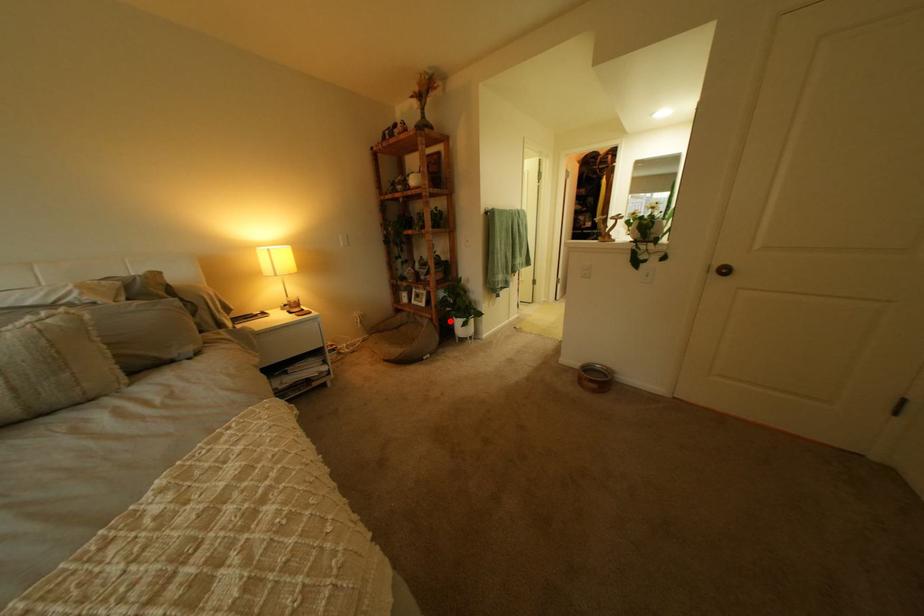
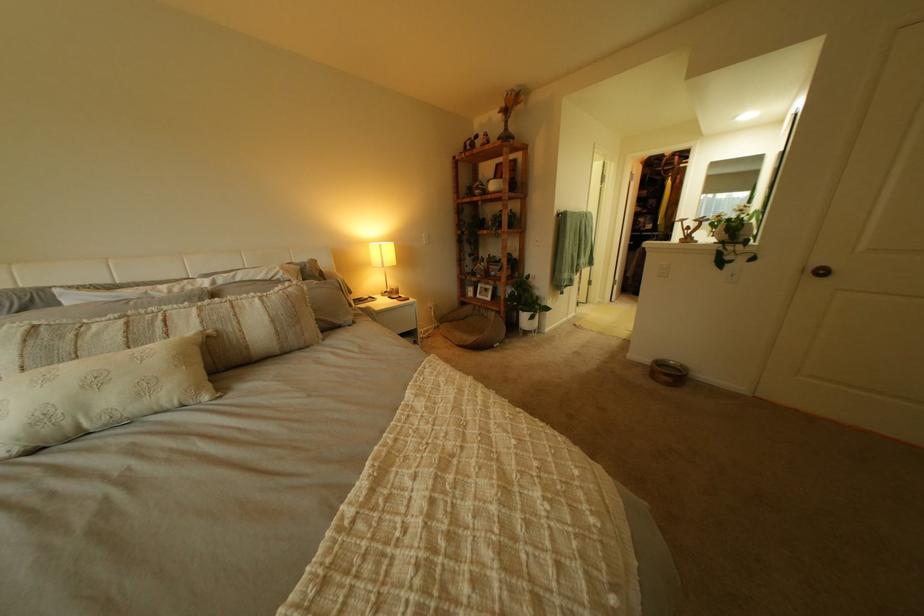
Find the pixel in the second image that matches the highlighted location in the first image.

(517, 314)